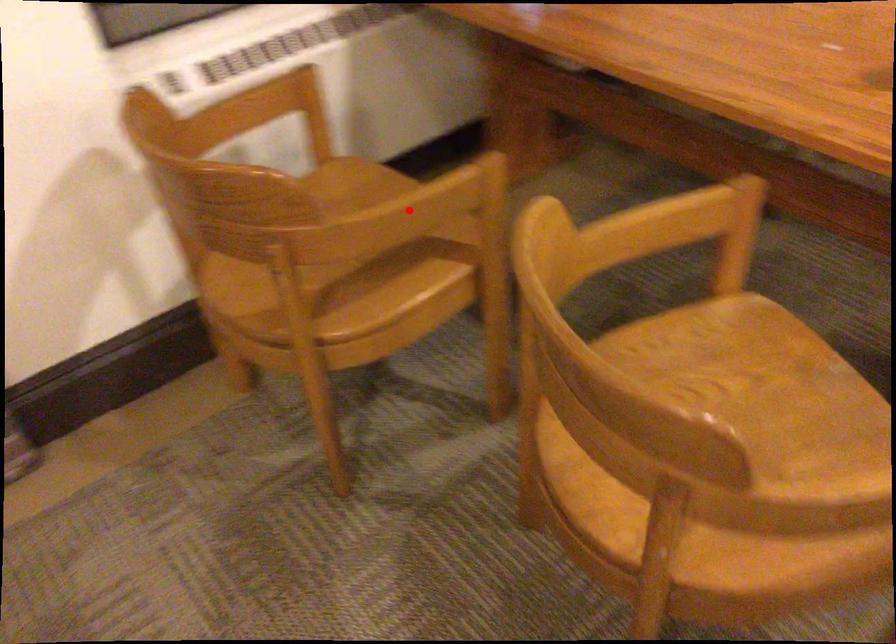
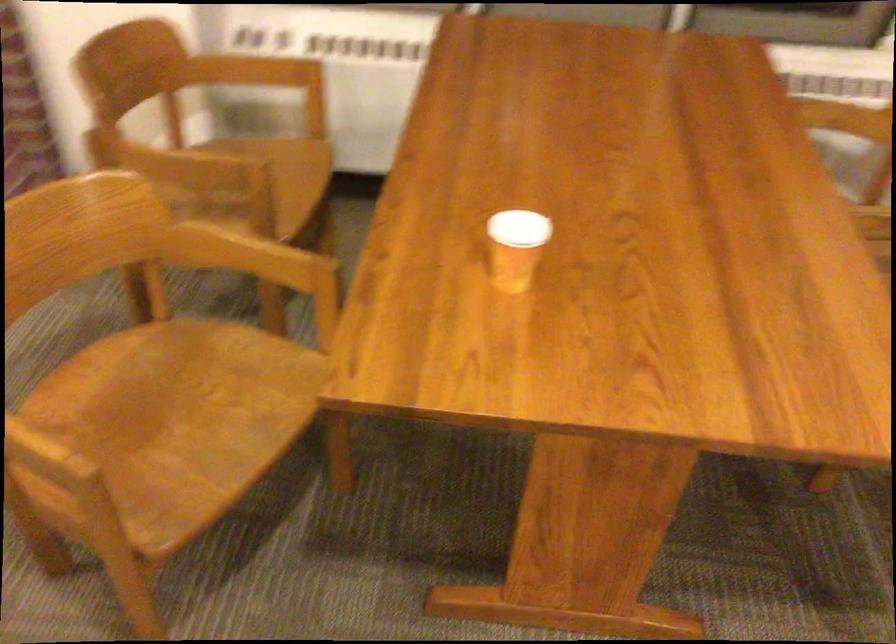
Question: A red point is marked in image1. In image2, is the corresponding 3D point closer to the camera or farther? Reply with the corresponding letter.

Choices:
 (A) The corresponding 3D point is closer.
 (B) The corresponding 3D point is farther.

Answer: (B)